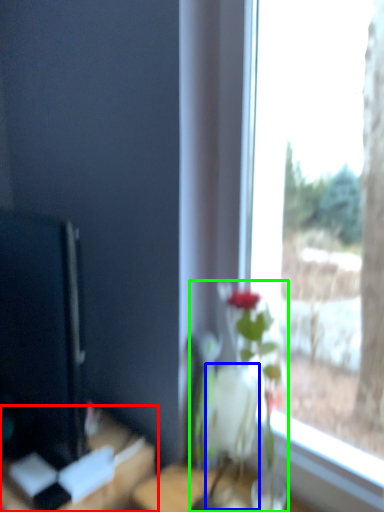
Question: Considering the real-world distances, which object is closest to table (highlighted by a red box)? vase (highlighted by a blue box) or houseplant (highlighted by a green box).

Choices:
 (A) vase
 (B) houseplant

Answer: (B)